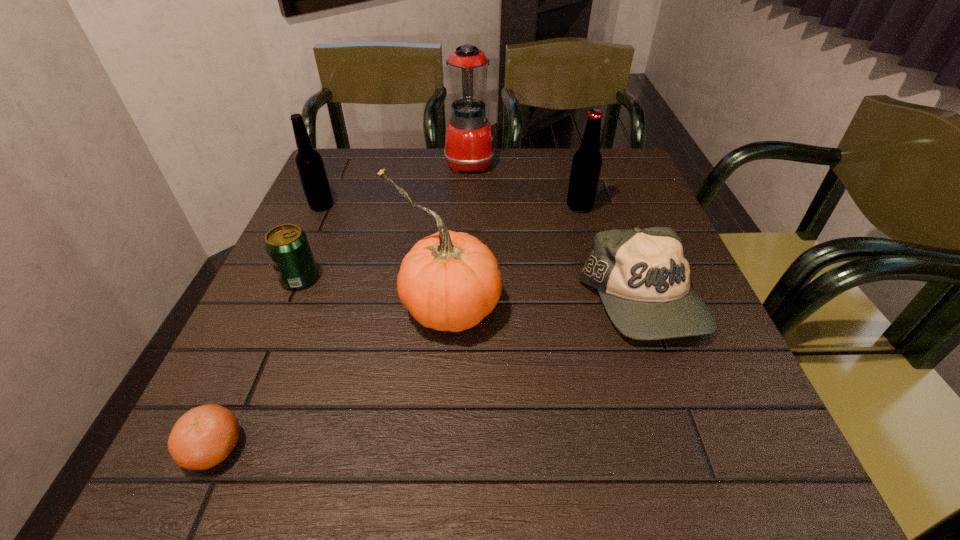
Where is `the farthest object`? This screenshot has height=540, width=960. the farthest object is located at coordinates (469, 146).

Locate an element on the screen. pumpkin is located at coordinates (449, 281).

Identify the location of the right beer bottle. The height and width of the screenshot is (540, 960). (587, 161).

Where is `the left beer bottle`? the left beer bottle is located at coordinates (309, 163).

The width and height of the screenshot is (960, 540). Identify the location of beer can. (287, 246).

At what (x,y) coordinates should I click in order to perform the action: click on baseball cap. Please return your answer as a coordinate pair (x, y). This screenshot has width=960, height=540. Looking at the image, I should click on (643, 278).

I want to click on clementine, so click(x=204, y=436).

Find the location of `the nearest object`. the nearest object is located at coordinates (204, 436).

This screenshot has height=540, width=960. Identify the location of free spot located on the controls of the farthest object. (529, 162).

Where is `vacant region located 0.370m on the right of the pumpkin`? The image size is (960, 540). vacant region located 0.370m on the right of the pumpkin is located at coordinates click(692, 306).